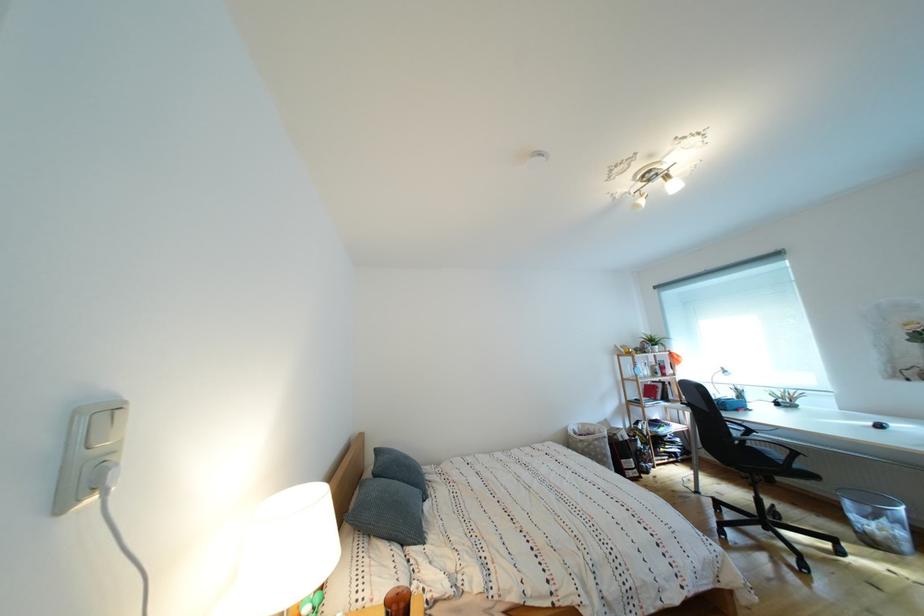
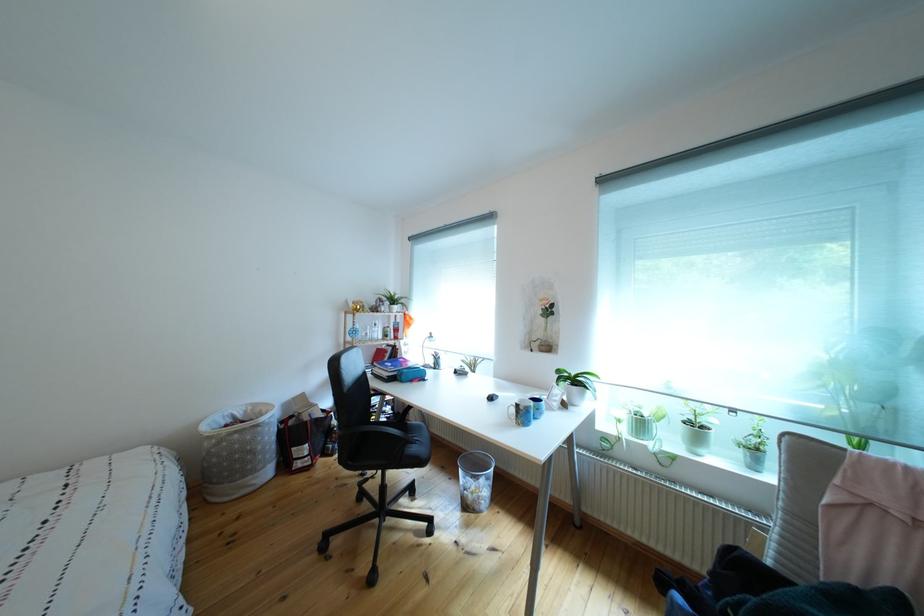
In the second image, find the point that corresponds to point 616,461 in the first image.

(263, 456)